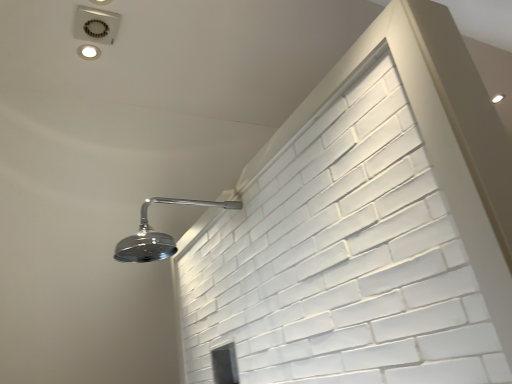
Question: Is matte white droplight at upper left, the 1th droplight when ordered from left to right, taller than matte silver droplight at upper right, which is the first droplight from right to left?

Choices:
 (A) yes
 (B) no

Answer: (A)

Question: Would you say matte silver droplight at upper right, marked as the 2th droplight in a front-to-back arrangement, is part of matte white droplight at upper left, placed as the second droplight when sorted from right to left,'s contents?

Choices:
 (A) yes
 (B) no

Answer: (B)

Question: Does matte white droplight at upper left, the 1th droplight when ordered from left to right, have a greater width compared to matte silver droplight at upper right, marked as the 2th droplight in a front-to-back arrangement?

Choices:
 (A) no
 (B) yes

Answer: (A)

Question: From a real-world perspective, does matte white droplight at upper left, which ranks as the second droplight in back-to-front order, stand above matte silver droplight at upper right, marked as the 1th droplight in a back-to-front arrangement?

Choices:
 (A) yes
 (B) no

Answer: (B)

Question: Considering the relative sizes of matte white droplight at upper left, placed as the second droplight when sorted from right to left, and matte silver droplight at upper right, positioned as the second droplight in left-to-right order, in the image provided, is matte white droplight at upper left, placed as the second droplight when sorted from right to left, thinner than matte silver droplight at upper right, positioned as the second droplight in left-to-right order,?

Choices:
 (A) no
 (B) yes

Answer: (B)

Question: In terms of size, does chrome metallic shower head at upper left appear bigger or smaller than matte silver droplight at upper right, marked as the 2th droplight in a front-to-back arrangement?

Choices:
 (A) big
 (B) small

Answer: (A)

Question: From the image's perspective, is chrome metallic shower head at upper left located above or below matte silver droplight at upper right, marked as the 2th droplight in a front-to-back arrangement?

Choices:
 (A) below
 (B) above

Answer: (A)

Question: Is chrome metallic shower head at upper left in front of or behind matte silver droplight at upper right, marked as the 2th droplight in a front-to-back arrangement, in the image?

Choices:
 (A) front
 (B) behind

Answer: (A)

Question: Considering the positions of chrome metallic shower head at upper left and matte silver droplight at upper right, marked as the 1th droplight in a back-to-front arrangement, in the image, is chrome metallic shower head at upper left wider or thinner than matte silver droplight at upper right, marked as the 1th droplight in a back-to-front arrangement,?

Choices:
 (A) wide
 (B) thin

Answer: (A)

Question: Considering their positions, is chrome metallic shower head at upper left located in front of or behind matte white droplight at upper left, the 1th droplight when ordered from left to right?

Choices:
 (A) behind
 (B) front

Answer: (B)

Question: From the image's perspective, is chrome metallic shower head at upper left above or below matte white droplight at upper left, the 1th droplight when ordered from left to right?

Choices:
 (A) below
 (B) above

Answer: (A)

Question: Is point (136, 233) closer or farther from the camera than point (82, 49)?

Choices:
 (A) farther
 (B) closer

Answer: (A)

Question: Is chrome metallic shower head at upper left inside or outside of matte white droplight at upper left, which ranks as the second droplight in back-to-front order?

Choices:
 (A) inside
 (B) outside

Answer: (B)

Question: Considering their positions, is matte silver droplight at upper right, positioned as the second droplight in left-to-right order, located in front of or behind matte white droplight at upper left, the 1th droplight when ordered from left to right?

Choices:
 (A) behind
 (B) front

Answer: (A)

Question: Is point (500, 94) closer or farther from the camera than point (90, 49)?

Choices:
 (A) farther
 (B) closer

Answer: (A)